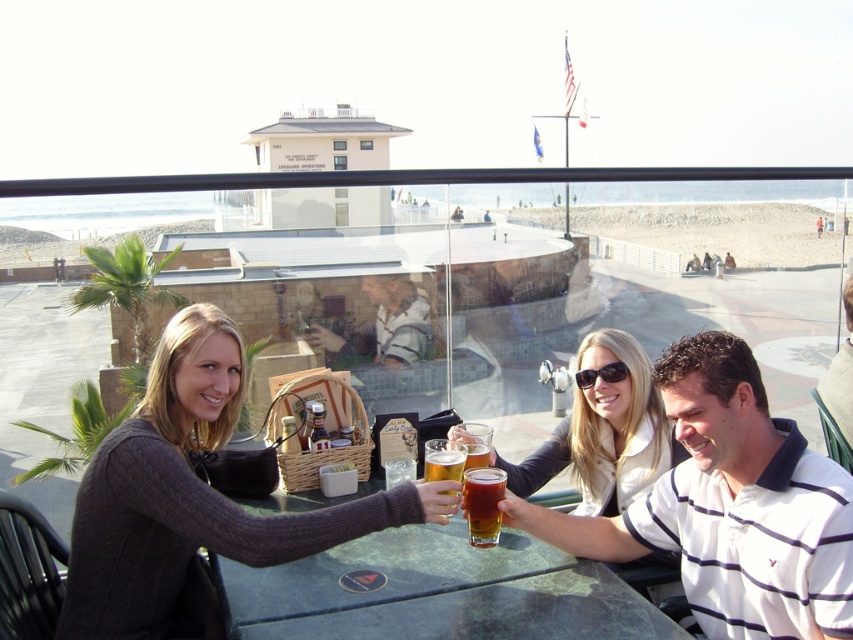
You are standing at the edge of the beach looking towards the green marble table. There are two points marked in the scene, one at coordinates point (722,545) and the other at point (462,458). Which of these two points is closer to you?

Point (722,545) is closer to the viewer than point (462,458).

You are standing at the center of the beachside scene and want to find the white striped polo shirt at right. Which direction should you look to locate it?

The white striped polo shirt at right is positioned at point 0.588 on the x axis and 0.986 on the y axis, so you should look towards the lower right direction to locate it.

You are a photographer trying to capture a candid shot of the white striped polo shirt at right and the amber glass beer at center. Since you want to ensure both subjects are in focus, you need to know their relative heights. Which one is taller?

The white striped polo shirt at right is much taller than the amber glass beer at center, so you should adjust your camera settings to accommodate the height difference for better focus.